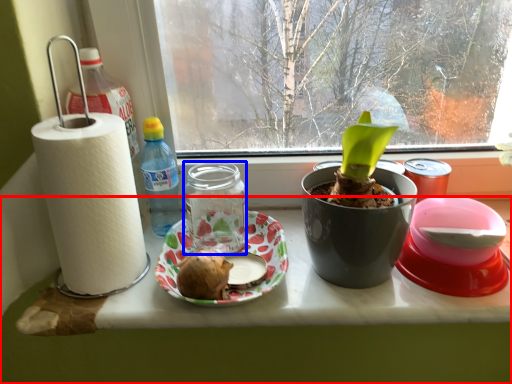
Question: Which object appears farthest to the camera in this image, table (highlighted by a red box) or glass jar (highlighted by a blue box)?

Choices:
 (A) table
 (B) glass jar

Answer: (B)